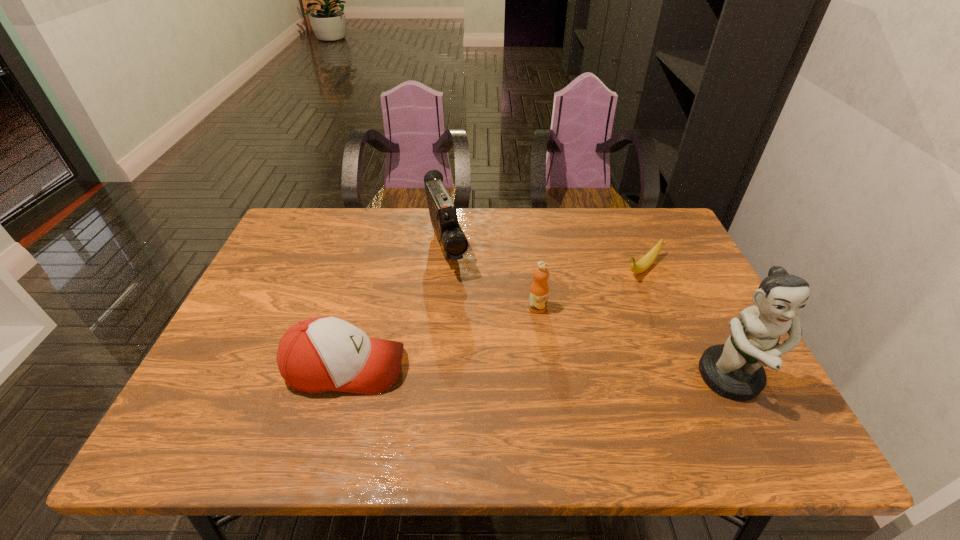
This screenshot has width=960, height=540. Find the location of `figurine located at the near edge`. figurine located at the near edge is located at coordinates (734, 370).

I want to click on figurine that is at the right edge, so click(734, 370).

In order to click on banana present at the right edge in this screenshot , I will do `click(646, 261)`.

Where is `object that is at the far right corner`? The width and height of the screenshot is (960, 540). object that is at the far right corner is located at coordinates (646, 261).

At what (x,y) coordinates should I click in order to perform the action: click on object located at the near right corner. Please return your answer as a coordinate pair (x, y). Image resolution: width=960 pixels, height=540 pixels. Looking at the image, I should click on click(734, 370).

Locate an element on the screen. The width and height of the screenshot is (960, 540). vacant space at the far edge of the desktop is located at coordinates (526, 223).

In the image, there is a desktop. Find the location of `vacant space at the near edge`. vacant space at the near edge is located at coordinates (428, 404).

In the image, there is a desktop. At what (x,y) coordinates should I click in order to perform the action: click on vacant space at the left edge. Please return your answer as a coordinate pair (x, y). This screenshot has width=960, height=540. Looking at the image, I should click on tap(242, 357).

This screenshot has width=960, height=540. In order to click on free spot at the right edge of the desktop in this screenshot , I will do `click(674, 312)`.

Find the location of a particular element. free spot at the near left corner of the desktop is located at coordinates (234, 385).